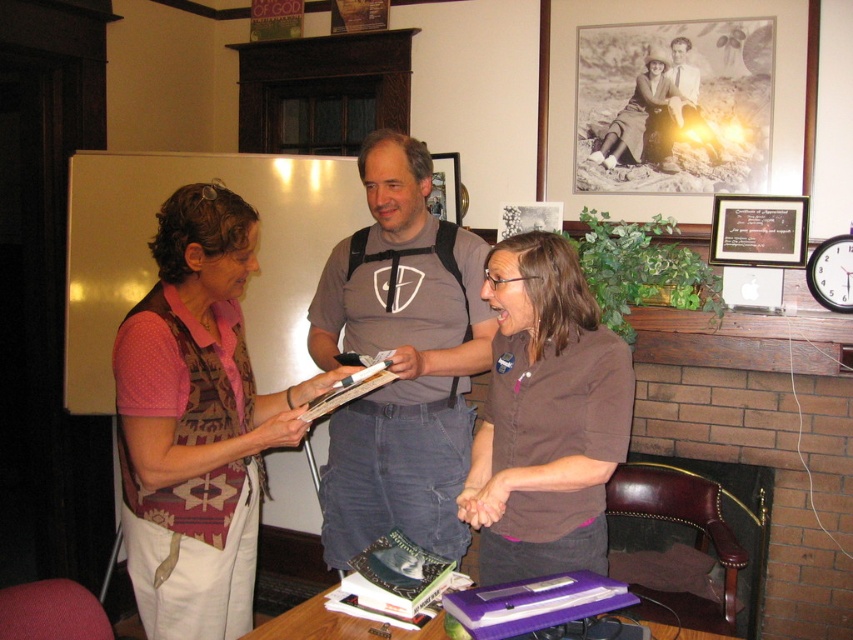
You are a GUI agent. You are given a task and a screenshot of the screen. Output one action in this format:
    pyautogui.click(x=<x>, y=<y>)
    Task: Click on the black matte picture frame at upper center
    The width and height of the screenshot is (853, 640).
    Given the screenshot: What is the action you would take?
    pyautogui.click(x=659, y=19)

Does black matte picture frame at upper center have a lesser width compared to purple plastic book at lower center?

No.

Measure the distance between black matte picture frame at upper center and camera.

black matte picture frame at upper center is 9.02 feet away from camera.

This screenshot has width=853, height=640. Find the location of `black matte picture frame at upper center`. black matte picture frame at upper center is located at coordinates (659, 19).

Is matte black picture frame at upper right smaller than hardcover book at center?

No, matte black picture frame at upper right is not smaller than hardcover book at center.

Measure the distance between point [712,205] and camera.

They are 9.23 feet apart.

Where is `matte black picture frame at upper right`? This screenshot has width=853, height=640. matte black picture frame at upper right is located at coordinates (758, 230).

Between point (432, 410) and point (440, 186), which one is positioned behind?

Positioned behind is point (440, 186).

Is point (447, 250) closer to viewer compared to point (437, 188)?

That is True.

Where is `brown cotton t-shirt at center`? The height and width of the screenshot is (640, 853). brown cotton t-shirt at center is located at coordinates (399, 358).